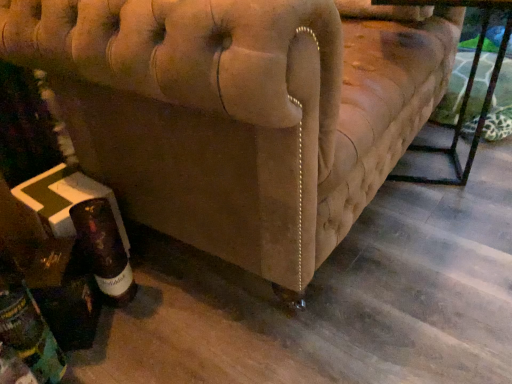
Where is `vacant area that is in front of brown glass bottle at lower left, placed as the 1th bottle when sorted from right to left`? vacant area that is in front of brown glass bottle at lower left, placed as the 1th bottle when sorted from right to left is located at coordinates (130, 341).